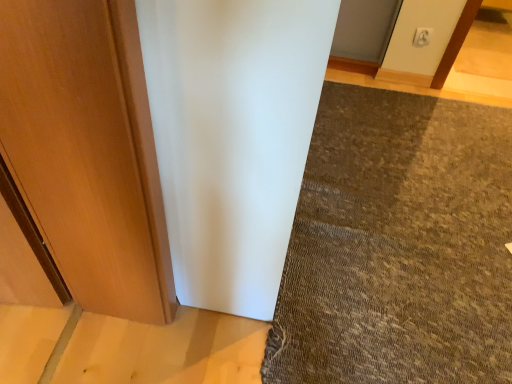
This screenshot has width=512, height=384. I want to click on brown textured mat at lower right, so click(398, 245).

Describe the element at coordinates (398, 245) in the screenshot. I see `brown textured mat at lower right` at that location.

Measure the distance between white plastic electric outlet at upper center and camera.

→ 2.19 meters.

What do you see at coordinates (422, 36) in the screenshot? I see `white plastic electric outlet at upper center` at bounding box center [422, 36].

Find the location of a particular element. The image size is (512, 384). white plastic electric outlet at upper center is located at coordinates (422, 36).

The image size is (512, 384). I want to click on brown textured mat at lower right, so click(398, 245).

Considering the positions of objects white plastic electric outlet at upper center and brown textured mat at lower right in the image provided, who is more to the left, white plastic electric outlet at upper center or brown textured mat at lower right?

brown textured mat at lower right is more to the left.

Between white plastic electric outlet at upper center and brown textured mat at lower right, which one is positioned behind?

white plastic electric outlet at upper center is further from the camera.

Does point (416, 43) come farther from viewer compared to point (422, 383)?

Yes.

From the image's perspective, is white plastic electric outlet at upper center positioned above or below brown textured mat at lower right?

Clearly, from the image's perspective, white plastic electric outlet at upper center is above brown textured mat at lower right.

In the scene shown: From a real-world perspective, which object stands above the other?

white plastic electric outlet at upper center.

Between white plastic electric outlet at upper center and brown textured mat at lower right, which one has larger width?

With larger width is brown textured mat at lower right.

Can you confirm if white plastic electric outlet at upper center is taller than brown textured mat at lower right?

Yes, white plastic electric outlet at upper center is taller than brown textured mat at lower right.

Can you confirm if white plastic electric outlet at upper center is smaller than brown textured mat at lower right?

Indeed, white plastic electric outlet at upper center has a smaller size compared to brown textured mat at lower right.

Would you say white plastic electric outlet at upper center contains brown textured mat at lower right?

Actually, brown textured mat at lower right is outside white plastic electric outlet at upper center.

Would you say white plastic electric outlet at upper center is a long distance from brown textured mat at lower right?

Yes, white plastic electric outlet at upper center and brown textured mat at lower right are quite far apart.

In the scene shown: Does white plastic electric outlet at upper center turn towards brown textured mat at lower right?

Yes, white plastic electric outlet at upper center is turned towards brown textured mat at lower right.

How many degrees apart are the facing directions of white plastic electric outlet at upper center and brown textured mat at lower right?

The facing directions of white plastic electric outlet at upper center and brown textured mat at lower right are 88.9 degrees apart.

You are a GUI agent. You are given a task and a screenshot of the screen. Output one action in this format:
    pyautogui.click(x=<x>, y=<y>)
    Task: Click on the mat in front of the white plastic electric outlet at upper center
    The height and width of the screenshot is (384, 512).
    Given the screenshot: What is the action you would take?
    pyautogui.click(x=398, y=245)

Which object is positioned more to the left, brown textured mat at lower right or white plastic electric outlet at upper center?

Positioned to the left is brown textured mat at lower right.

Relative to white plastic electric outlet at upper center, is brown textured mat at lower right in front or behind?

brown textured mat at lower right is in front of white plastic electric outlet at upper center.

Is point (464, 295) positioned before point (415, 37)?

That is True.

From the image's perspective, which one is positioned lower, brown textured mat at lower right or white plastic electric outlet at upper center?

brown textured mat at lower right is shown below in the image.

From a real-world perspective, is brown textured mat at lower right physically above white plastic electric outlet at upper center?

No, from a real-world perspective, brown textured mat at lower right is not on top of white plastic electric outlet at upper center.

Which of these two, brown textured mat at lower right or white plastic electric outlet at upper center, is wider?

With larger width is brown textured mat at lower right.

Between brown textured mat at lower right and white plastic electric outlet at upper center, which one has less height?

Standing shorter between the two is brown textured mat at lower right.

Is brown textured mat at lower right bigger than white plastic electric outlet at upper center?

Yes.

Is brown textured mat at lower right not within white plastic electric outlet at upper center?

That's correct, brown textured mat at lower right is outside of white plastic electric outlet at upper center.

From the picture: Is brown textured mat at lower right not close to white plastic electric outlet at upper center?

Indeed, brown textured mat at lower right is not near white plastic electric outlet at upper center.

Is brown textured mat at lower right aimed at white plastic electric outlet at upper center?

No, brown textured mat at lower right is not aimed at white plastic electric outlet at upper center.

The width and height of the screenshot is (512, 384). I want to click on mat lying in front of the white plastic electric outlet at upper center, so click(398, 245).

You are a GUI agent. You are given a task and a screenshot of the screen. Output one action in this format:
    pyautogui.click(x=<x>, y=<y>)
    Task: Click on the electric outlet above the brown textured mat at lower right (from a real-world perspective)
    This screenshot has width=512, height=384.
    Given the screenshot: What is the action you would take?
    pyautogui.click(x=422, y=36)

This screenshot has height=384, width=512. Find the location of `mat below the white plastic electric outlet at upper center (from the image's perspective)`. mat below the white plastic electric outlet at upper center (from the image's perspective) is located at coordinates (398, 245).